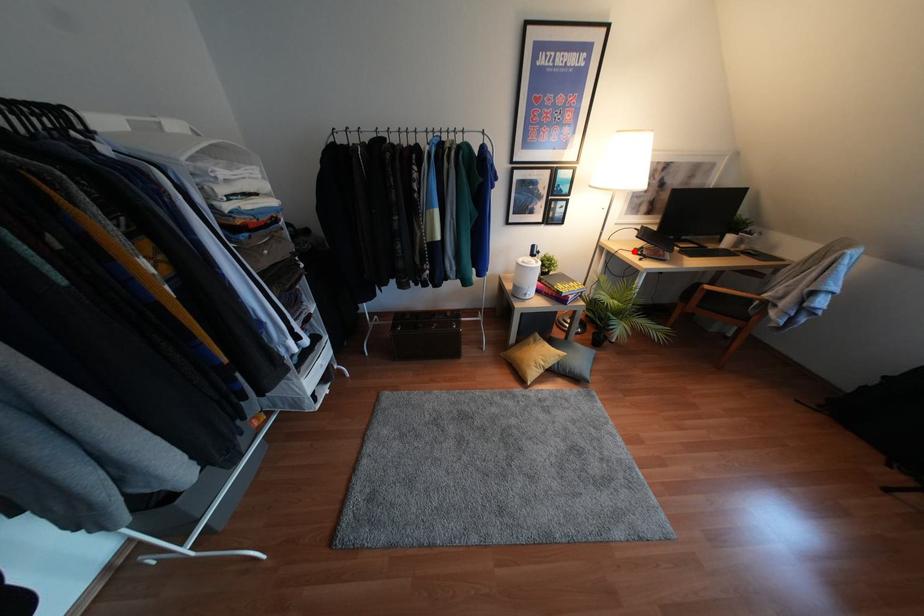
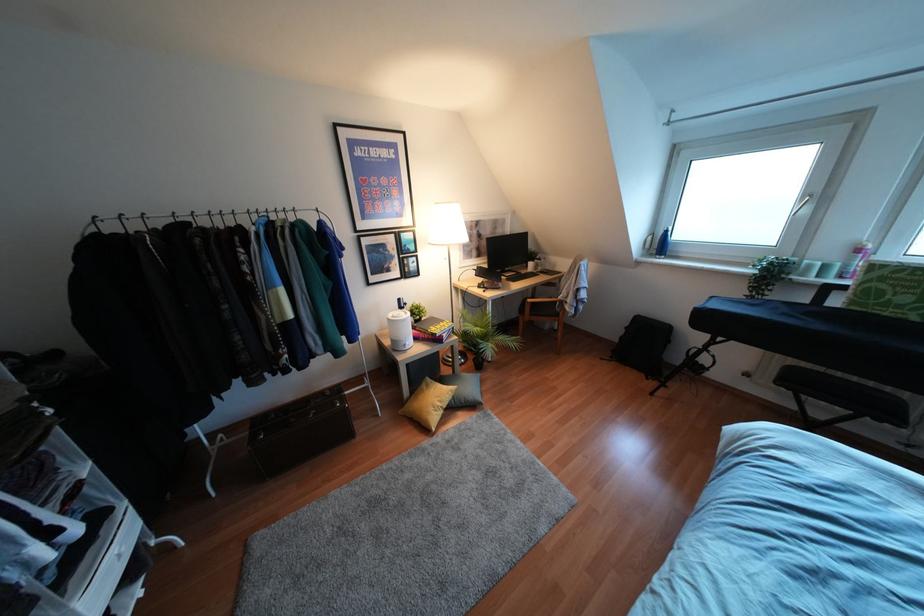
In the second image, find the point that corresponds to the highlighted location in the first image.

(478, 286)